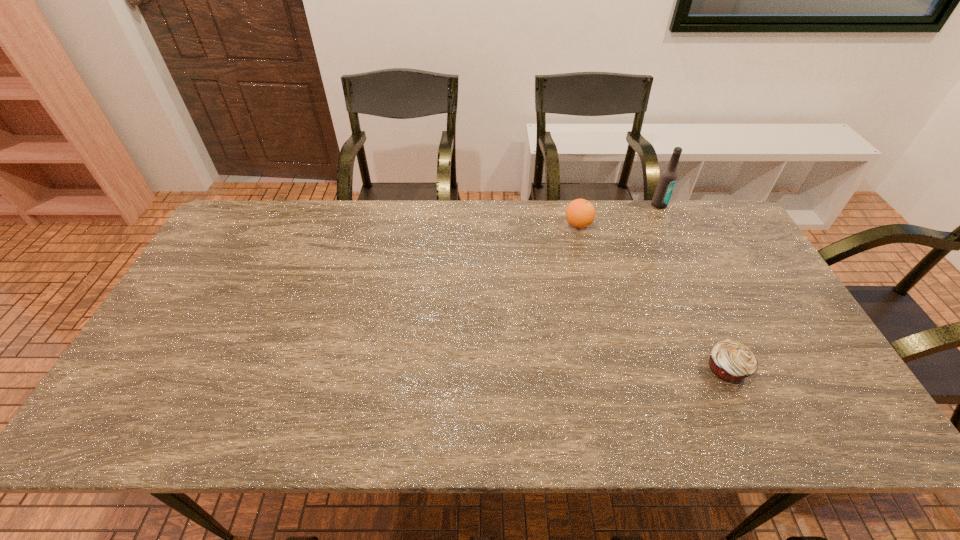
Where is `free space that satisfies the following two spatial constraints: 1. on the front side of the muffin; 2. on the right side of the leftmost object`? free space that satisfies the following two spatial constraints: 1. on the front side of the muffin; 2. on the right side of the leftmost object is located at coordinates [613, 369].